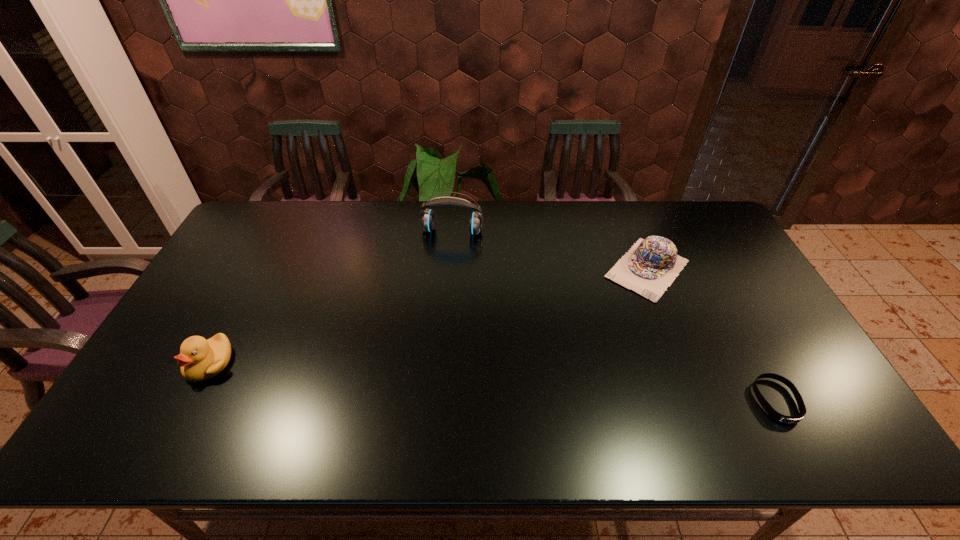
The height and width of the screenshot is (540, 960). Find the location of `duckling`. duckling is located at coordinates (200, 359).

Identify the location of the second tallest object. (200, 359).

Identify the location of the shortest object. The height and width of the screenshot is (540, 960). (775, 415).

Identify the location of headset. This screenshot has height=540, width=960. (427, 219).

At what (x,y) coordinates should I click in order to perform the action: click on the tallest object. Please return your answer as a coordinate pair (x, y). Looking at the image, I should click on 427,219.

This screenshot has height=540, width=960. I want to click on cap, so click(651, 265).

This screenshot has width=960, height=540. Identify the location of vacant region located on the front-facing side of the third shortest object. (189, 402).

Where is `vacant space located 0.180m on the ear cups of the second object from left to right`? The image size is (960, 540). vacant space located 0.180m on the ear cups of the second object from left to right is located at coordinates (441, 275).

Image resolution: width=960 pixels, height=540 pixels. Find the location of `free spot located 0.210m on the ear cups of the second object from left to right`. free spot located 0.210m on the ear cups of the second object from left to right is located at coordinates (439, 282).

Find the location of a particular element. The width and height of the screenshot is (960, 540). vacant space situated 0.310m on the ear cups of the second object from left to right is located at coordinates (433, 306).